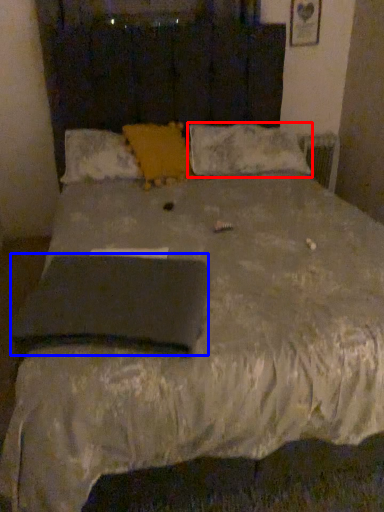
Question: Which point is further to the camera, pillow (highlighted by a red box) or pad (highlighted by a blue box)?

Choices:
 (A) pillow
 (B) pad

Answer: (A)